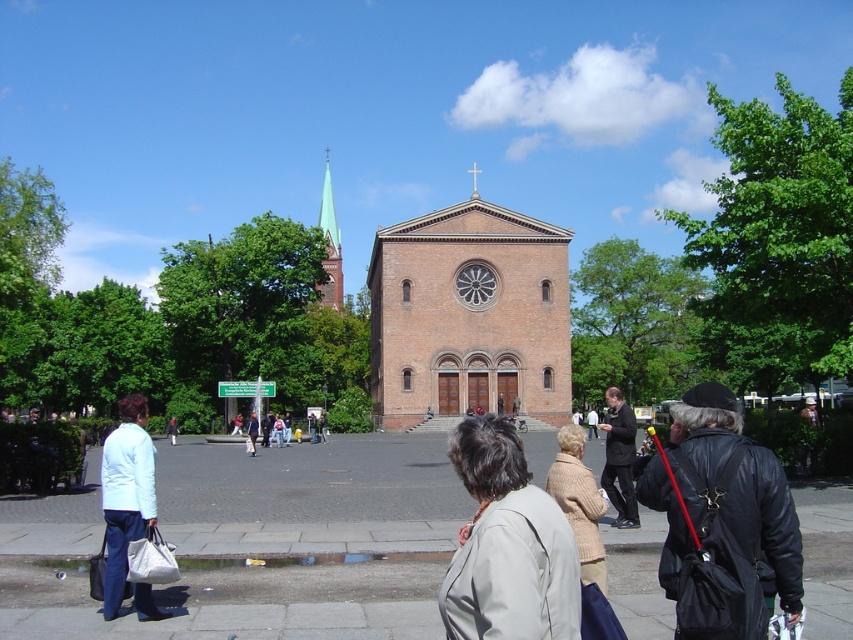
You are standing in the square in front of the church and see a dark brown leather jacket at center and a green glass steeple at upper center. Which object is closer to your right side?

The dark brown leather jacket at center is positioned on the right side of the green glass steeple at upper center, so it is closer to your right side.